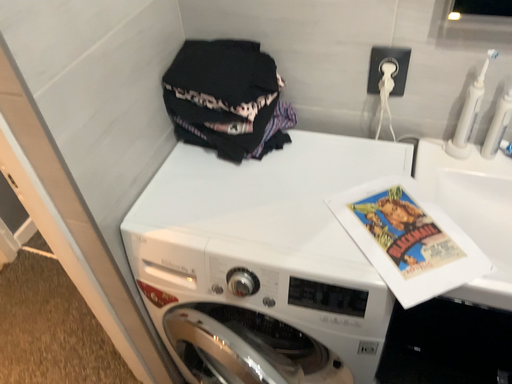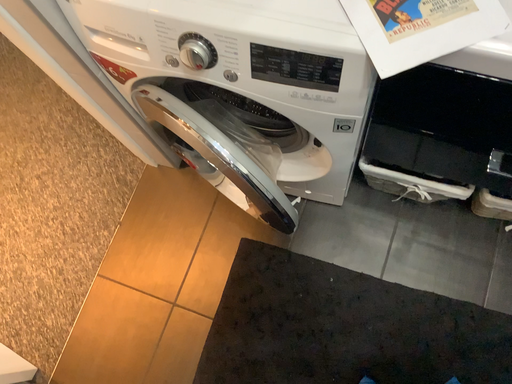
Question: How did the camera likely rotate when shooting the video?

Choices:
 (A) rotated downward
 (B) rotated upward

Answer: (A)